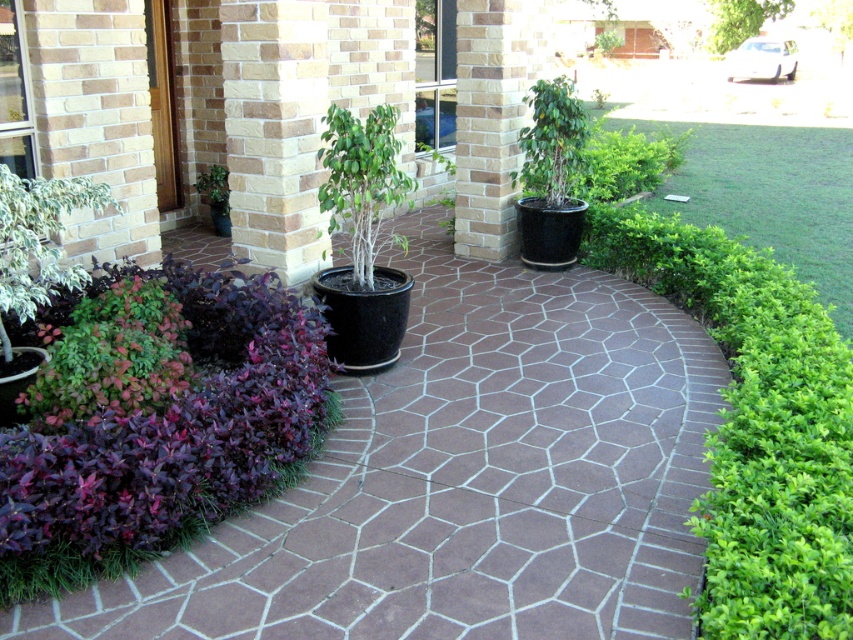
Question: Is the position of purple leafy plant at lower left more distant than that of brown textured pillar at center?

Choices:
 (A) yes
 (B) no

Answer: (B)

Question: Which point appears closest to the camera in this image?

Choices:
 (A) (329, 128)
 (B) (822, 371)

Answer: (B)

Question: Estimate the real-world distances between objects in this image. Which object is farther from the green glossy bush at left?

Choices:
 (A) purple leafy plant at lower left
 (B) brown textured pillar at center
 (C) green matte tree at center
 (D) green leafy bush at right

Answer: (B)

Question: Among these points, which one is nearest to the camera?

Choices:
 (A) (590, 189)
 (B) (569, 563)

Answer: (B)

Question: Is purple leafy plant at lower left bigger than green glossy bush at left?

Choices:
 (A) no
 (B) yes

Answer: (B)

Question: Observing the image, what is the correct spatial positioning of purple leafy plant at lower left in reference to brown textured pillar at center?

Choices:
 (A) below
 (B) above

Answer: (A)